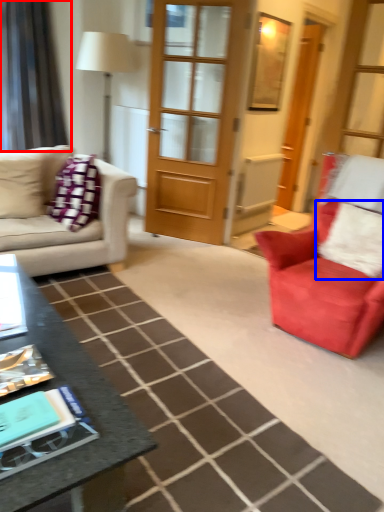
Question: Which point is closer to the camera, curtain (highlighted by a red box) or pillow (highlighted by a blue box)?

Choices:
 (A) curtain
 (B) pillow

Answer: (B)